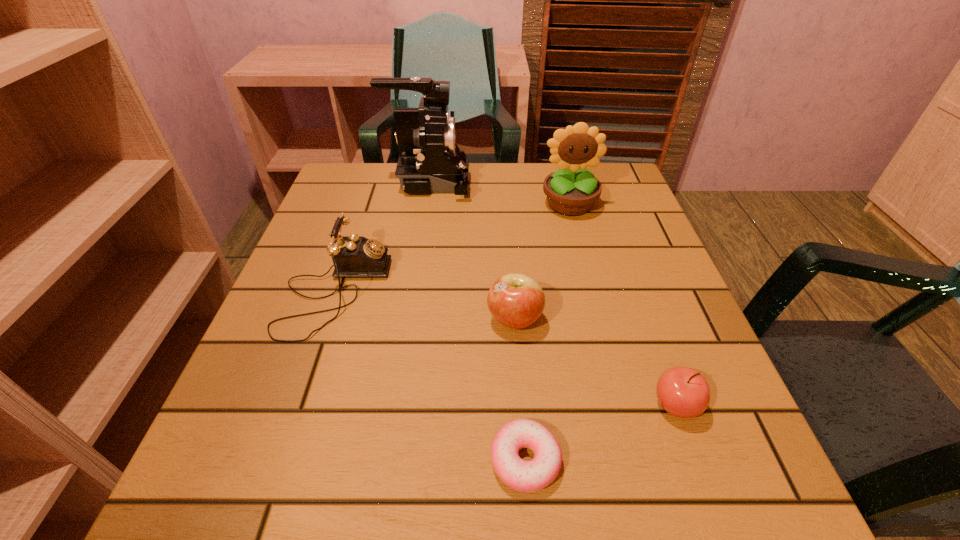
I want to click on apple at the right edge, so (683, 392).

This screenshot has height=540, width=960. In order to click on object present at the far left corner in this screenshot , I will do `click(430, 161)`.

This screenshot has width=960, height=540. What are the coordinates of `object that is at the far right corner` in the screenshot? It's located at (572, 190).

In the image, there is a desktop. Identify the location of vacant space at the far edge. This screenshot has width=960, height=540. (484, 183).

Identify the location of vacant space at the near edge of the desktop. (596, 505).

At what (x,y) coordinates should I click in order to perform the action: click on vacant space at the left edge of the desktop. Please return your answer as a coordinate pair (x, y). The width and height of the screenshot is (960, 540). Looking at the image, I should click on (304, 415).

This screenshot has width=960, height=540. Find the location of `vacant space at the right edge`. vacant space at the right edge is located at coordinates [x=613, y=278].

Identify the location of vacant area at the far left corner. (386, 211).

Locate an element on the screen. The height and width of the screenshot is (540, 960). free spot between the telephone and the left apple is located at coordinates (424, 306).

Where is `free space that is in between the nearest object and the fifth shortest object`? The height and width of the screenshot is (540, 960). free space that is in between the nearest object and the fifth shortest object is located at coordinates (547, 332).